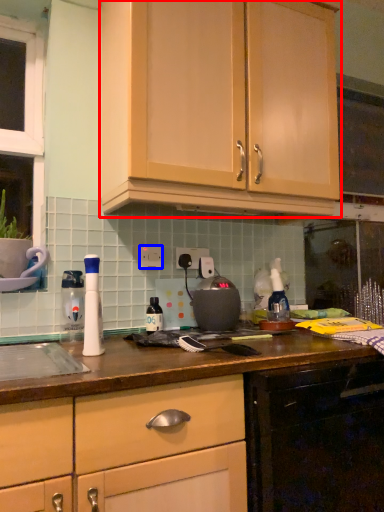
Question: Among these objects, which one is nearest to the camera, cabinetry (highlighted by a red box) or electric outlet (highlighted by a blue box)?

Choices:
 (A) cabinetry
 (B) electric outlet

Answer: (A)